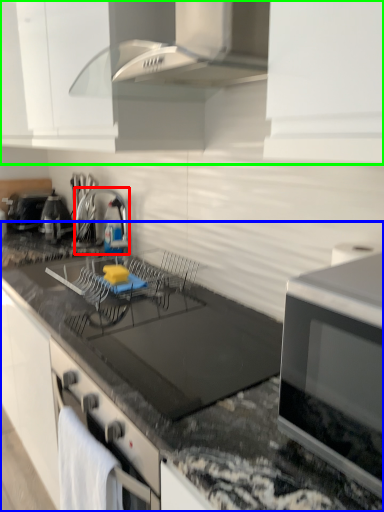
Question: Based on their relative distances, which object is nearer to appliance (highlighted by a red box)? Choose from countertop (highlighted by a blue box) and cabinetry (highlighted by a green box).

Choices:
 (A) countertop
 (B) cabinetry

Answer: (B)